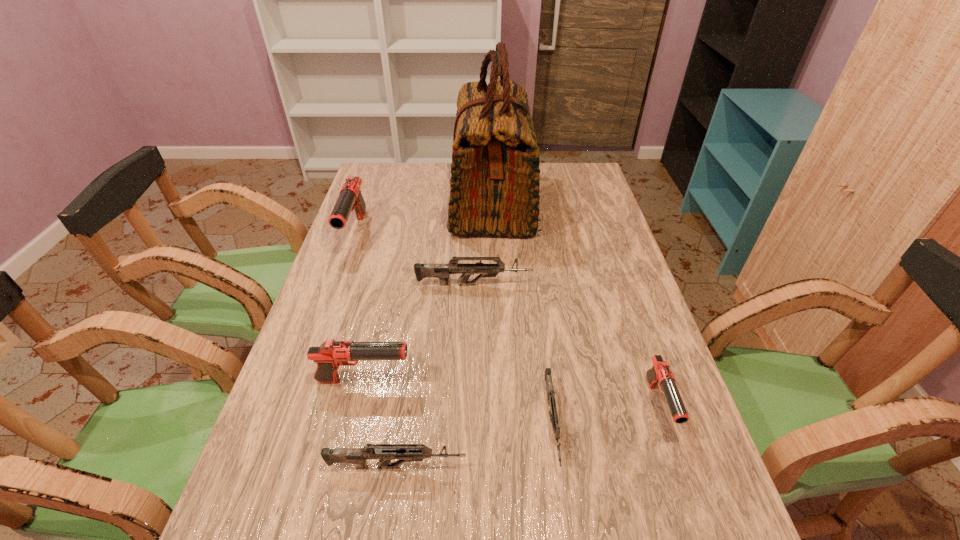
Locate an element on the screen. the tallest object is located at coordinates (494, 183).

Image resolution: width=960 pixels, height=540 pixels. I want to click on the farthest gun, so click(350, 198).

Locate an element on the screen. The image size is (960, 540). the tallest gun is located at coordinates (350, 198).

Identify the location of the second tallest gun. The image size is (960, 540). (330, 355).

What are the coordinates of `the second black gun from right to left` in the screenshot? It's located at (330, 355).

I want to click on the rightmost object, so [x=660, y=373].

I want to click on the rightmost black gun, so click(660, 373).

You are a GUI agent. You are given a task and a screenshot of the screen. Output one action in this format:
    pyautogui.click(x=<x>, y=<y>)
    Task: Click on the farthest grey gun
    
    Given the screenshot: What is the action you would take?
    (442, 271)

Identify the location of the biggest grey gun. (x=442, y=271).

Where is `the second shortest gun`? the second shortest gun is located at coordinates (385, 453).